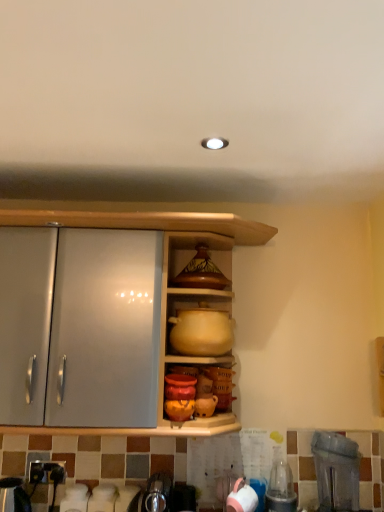
I want to click on metallic silver kettle at lower left, the 1th appliance viewed from the left, so click(x=13, y=496).

Measure the distance between matte yellow clay pot at center and camera.

The depth of matte yellow clay pot at center is 5.19 feet.

The height and width of the screenshot is (512, 384). I want to click on transparent plastic blender at lower right, which is counted as the 2th appliance, starting from the left, so click(336, 471).

Which object is closer to the camera, pink matte cup at lower center or metallic silver kettle at lower left, the 1th appliance viewed from the left?

pink matte cup at lower center.

From a real-world perspective, is pink matte cup at lower center physically above metallic silver kettle at lower left, the 1th appliance viewed from the left?

Yes, from a real-world perspective, pink matte cup at lower center is on top of metallic silver kettle at lower left, the 1th appliance viewed from the left.

Are pink matte cup at lower center and metallic silver kettle at lower left, the 1th appliance viewed from the left, far apart?

pink matte cup at lower center is near metallic silver kettle at lower left, the 1th appliance viewed from the left, not far away.

Does pink matte cup at lower center have a greater width compared to metallic silver kettle at lower left, placed as the second appliance when sorted from right to left?

In fact, pink matte cup at lower center might be narrower than metallic silver kettle at lower left, placed as the second appliance when sorted from right to left.

Can you confirm if matte yellow clay pot at center is taller than matte brown ceramic pot at upper center?

Indeed, matte yellow clay pot at center has a greater height compared to matte brown ceramic pot at upper center.

The width and height of the screenshot is (384, 512). What are the coordinates of `shelf behind the matte yellow clay pot at center` in the screenshot? It's located at (197, 260).

Is matte yellow clay pot at center outside of matte brown ceramic pot at upper center?

Yes, matte yellow clay pot at center is not within matte brown ceramic pot at upper center.

Is the surface of transparent plastic blender at lower right, which is counted as the 2th appliance, starting from the left, in direct contact with matte yellow clay pot at center?

No, transparent plastic blender at lower right, which is counted as the 2th appliance, starting from the left, is not beside matte yellow clay pot at center.

From a real-world perspective, is transparent plastic blender at lower right, which is counted as the 2th appliance, starting from the left, physically below matte yellow clay pot at center?

Correct, in the physical world, transparent plastic blender at lower right, which is counted as the 2th appliance, starting from the left, is lower than matte yellow clay pot at center.

Consider the image. Who is smaller, pink matte cup at lower center or transparent plastic blender at lower right, which ranks as the first appliance in right-to-left order?

pink matte cup at lower center.

Based on the photo, is pink matte cup at lower center not inside transparent plastic blender at lower right, which ranks as the first appliance in right-to-left order?

Indeed, pink matte cup at lower center is completely outside transparent plastic blender at lower right, which ranks as the first appliance in right-to-left order.

Between pink matte cup at lower center and transparent plastic blender at lower right, which ranks as the first appliance in right-to-left order, which one has less height?

With less height is pink matte cup at lower center.

Is the depth of pink matte cup at lower center less than that of transparent plastic blender at lower right, which is counted as the 2th appliance, starting from the left?

No, pink matte cup at lower center is behind transparent plastic blender at lower right, which is counted as the 2th appliance, starting from the left.

From a real-world perspective, which is physically below, matte brown ceramic pot at upper center or matte yellow clay pot at center?

matte yellow clay pot at center is physically lower.

Does matte brown ceramic pot at upper center have a greater width compared to matte yellow clay pot at center?

No, matte brown ceramic pot at upper center is not wider than matte yellow clay pot at center.

Considering the relative sizes of matte brown ceramic pot at upper center and matte yellow clay pot at center in the image provided, is matte brown ceramic pot at upper center bigger than matte yellow clay pot at center?

No, matte brown ceramic pot at upper center is not bigger than matte yellow clay pot at center.

Is matte yellow clay pot at center inside the boundaries of transparent plastic blender at lower right, which is counted as the 2th appliance, starting from the left, or outside?

matte yellow clay pot at center exists outside the volume of transparent plastic blender at lower right, which is counted as the 2th appliance, starting from the left.

Which of these two, matte yellow clay pot at center or transparent plastic blender at lower right, which ranks as the first appliance in right-to-left order, stands taller?

transparent plastic blender at lower right, which ranks as the first appliance in right-to-left order, is taller.

Looking at this image, can you confirm if matte yellow clay pot at center is positioned to the right of transparent plastic blender at lower right, which ranks as the first appliance in right-to-left order?

Incorrect, matte yellow clay pot at center is not on the right side of transparent plastic blender at lower right, which ranks as the first appliance in right-to-left order.

Is point (177, 338) closer or farther from the camera than point (343, 479)?

Point (177, 338).

Which object is wider, metallic silver kettle at lower left, placed as the second appliance when sorted from right to left, or transparent plastic blender at lower right, which is counted as the 2th appliance, starting from the left?

Wider between the two is transparent plastic blender at lower right, which is counted as the 2th appliance, starting from the left.

Based on the photo, is metallic silver kettle at lower left, placed as the second appliance when sorted from right to left, turned away from transparent plastic blender at lower right, which ranks as the first appliance in right-to-left order?

No, metallic silver kettle at lower left, placed as the second appliance when sorted from right to left, is not facing away from transparent plastic blender at lower right, which ranks as the first appliance in right-to-left order.

From a real-world perspective, is metallic silver kettle at lower left, the 1th appliance viewed from the left, positioned under transparent plastic blender at lower right, which ranks as the first appliance in right-to-left order, based on gravity?

Yes, from a real-world perspective, metallic silver kettle at lower left, the 1th appliance viewed from the left, is beneath transparent plastic blender at lower right, which ranks as the first appliance in right-to-left order.

Locate an element on the screen. The height and width of the screenshot is (512, 384). appliance that appears below the pink matte cup at lower center (from a real-world perspective) is located at coordinates (13, 496).

Find the location of `pottery in front of the matte brown ceramic pot at upper center`. pottery in front of the matte brown ceramic pot at upper center is located at coordinates (201, 331).

In the scene shown: Looking at the image, which one is located further to transparent plastic blender at lower right, which is counted as the 2th appliance, starting from the left, matte brown ceramic pot at upper center or pink matte cup at lower center?

matte brown ceramic pot at upper center is positioned further to the anchor transparent plastic blender at lower right, which is counted as the 2th appliance, starting from the left.

Which object lies nearer to the anchor point matte yellow clay pot at center, matte brown ceramic pot at upper center or transparent plastic blender at lower right, which ranks as the first appliance in right-to-left order?

Among the two, matte brown ceramic pot at upper center is located nearer to matte yellow clay pot at center.

Based on their spatial positions, is pink matte cup at lower center or transparent plastic blender at lower right, which is counted as the 2th appliance, starting from the left, closer to metallic silver kettle at lower left, placed as the second appliance when sorted from right to left?

The object closer to metallic silver kettle at lower left, placed as the second appliance when sorted from right to left, is pink matte cup at lower center.

In the scene shown: Estimate the real-world distances between objects in this image. Which object is closer to transparent plastic blender at lower right, which is counted as the 2th appliance, starting from the left, pink matte cup at lower center or matte brown ceramic pot at upper center?

pink matte cup at lower center lies closer to transparent plastic blender at lower right, which is counted as the 2th appliance, starting from the left, than the other object.

From the picture: Considering their positions, is matte brown ceramic pot at upper center positioned further to transparent plastic blender at lower right, which is counted as the 2th appliance, starting from the left, than metallic silver kettle at lower left, placed as the second appliance when sorted from right to left?

Among the two, metallic silver kettle at lower left, placed as the second appliance when sorted from right to left, is located further to transparent plastic blender at lower right, which is counted as the 2th appliance, starting from the left.

Considering their positions, is matte yellow clay pot at center positioned closer to matte brown ceramic pot at upper center than pink matte cup at lower center?

Among the two, matte yellow clay pot at center is located nearer to matte brown ceramic pot at upper center.

From the image, which object appears to be nearer to metallic silver kettle at lower left, the 1th appliance viewed from the left, matte brown ceramic pot at upper center or transparent plastic blender at lower right, which is counted as the 2th appliance, starting from the left?

matte brown ceramic pot at upper center is closer to metallic silver kettle at lower left, the 1th appliance viewed from the left.

When comparing their distances from transparent plastic blender at lower right, which is counted as the 2th appliance, starting from the left, does metallic silver kettle at lower left, the 1th appliance viewed from the left, or pink matte cup at lower center seem further?

Among the two, metallic silver kettle at lower left, the 1th appliance viewed from the left, is located further to transparent plastic blender at lower right, which is counted as the 2th appliance, starting from the left.

You are a GUI agent. You are given a task and a screenshot of the screen. Output one action in this format:
    pyautogui.click(x=<x>, y=<y>)
    Task: Click on the pottery that lies between matte brown ceramic pot at upper center and pink matte cup at lower center from top to bottom
    
    Given the screenshot: What is the action you would take?
    [201, 331]

Image resolution: width=384 pixels, height=512 pixels. I want to click on pottery between metallic silver kettle at lower left, the 1th appliance viewed from the left, and pink matte cup at lower center, so click(201, 331).

Where is `tableware situated between metallic silver kettle at lower left, the 1th appliance viewed from the left, and transparent plastic blender at lower right, which is counted as the 2th appliance, starting from the left, from left to right`? Image resolution: width=384 pixels, height=512 pixels. tableware situated between metallic silver kettle at lower left, the 1th appliance viewed from the left, and transparent plastic blender at lower right, which is counted as the 2th appliance, starting from the left, from left to right is located at coordinates (242, 498).

This screenshot has width=384, height=512. I want to click on pottery between metallic silver kettle at lower left, placed as the second appliance when sorted from right to left, and transparent plastic blender at lower right, which is counted as the 2th appliance, starting from the left, so click(201, 331).